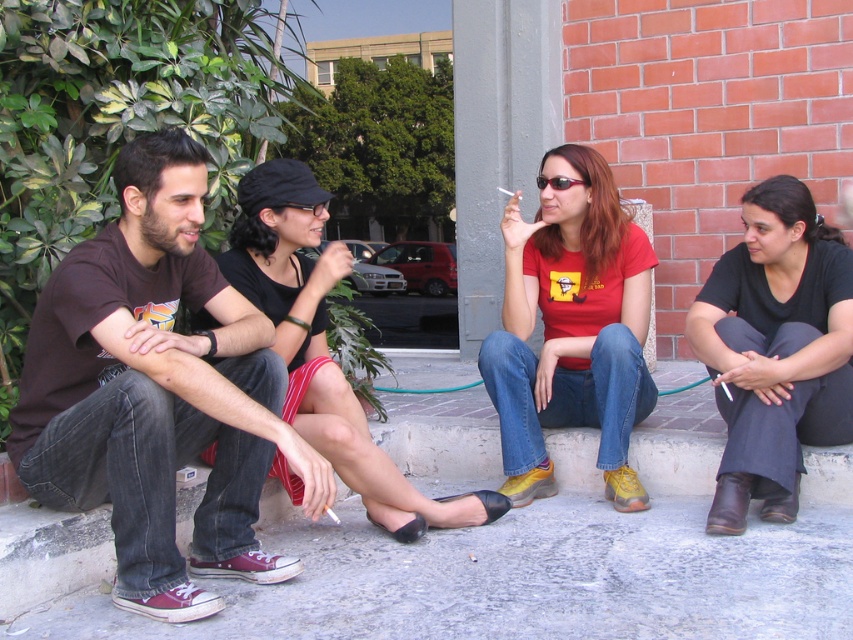
Question: Which point appears closest to the camera in this image?

Choices:
 (A) (778, 224)
 (B) (201, 173)
 (C) (254, 284)

Answer: (B)

Question: Is the position of dark brown t-shirt at left less distant than that of matte red t-shirt at center?

Choices:
 (A) no
 (B) yes

Answer: (B)

Question: Can you confirm if dark brown t-shirt at left is wider than matte red t-shirt at center?

Choices:
 (A) no
 (B) yes

Answer: (B)

Question: Which object is the farthest from the matte red t-shirt at center?

Choices:
 (A) matte black cap at center
 (B) dark brown t-shirt at left
 (C) black matte pants at lower right

Answer: (B)

Question: Is dark brown t-shirt at left bigger than matte black cap at center?

Choices:
 (A) yes
 (B) no

Answer: (A)

Question: Which object is closer to the camera taking this photo?

Choices:
 (A) dark brown t-shirt at left
 (B) matte red t-shirt at center

Answer: (A)